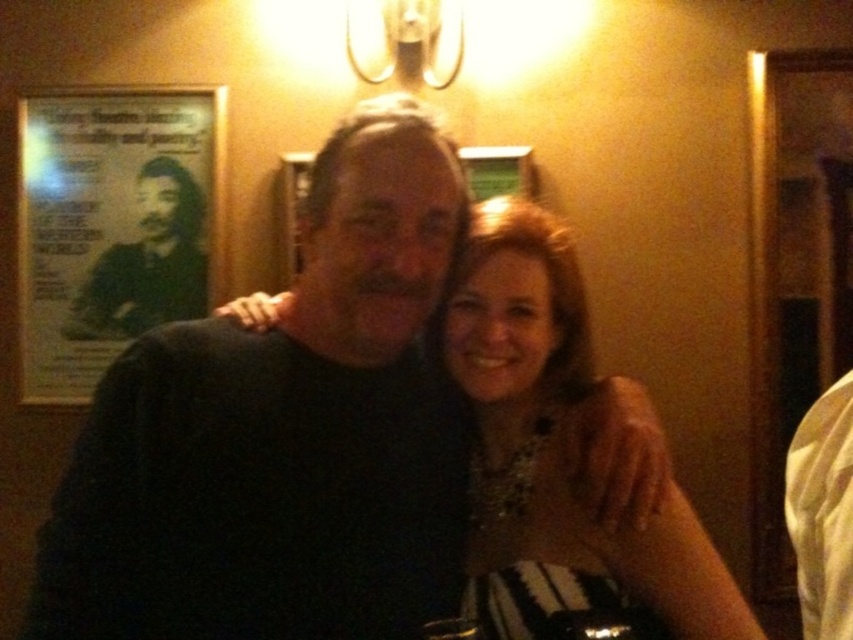
You are a photographer standing at a distance of 40 inches from the two people in the image. You want to capture a closeup shot of the shiny silver necklace at center without moving your position. Is the necklace within your camera lens focus range if the minimum focus distance is 35 inches?

The shiny silver necklace at center is 38.53 inches away from viewer. Since the minimum focus distance is 35 inches, the necklace is within the focus range and can be captured clearly without moving.

You are taking a photo of two people sitting side by side. You notice the black matte shirt at center and the shiny silver necklace at center. Which object is positioned to the left?

The black matte shirt at center is to the left of the shiny silver necklace at center, so the black matte shirt at center is positioned to the left.

You are trying to locate the black matte shirt at center in the image. What are the coordinates where you can find it?

The black matte shirt at center can be found at coordinates point [283,433].